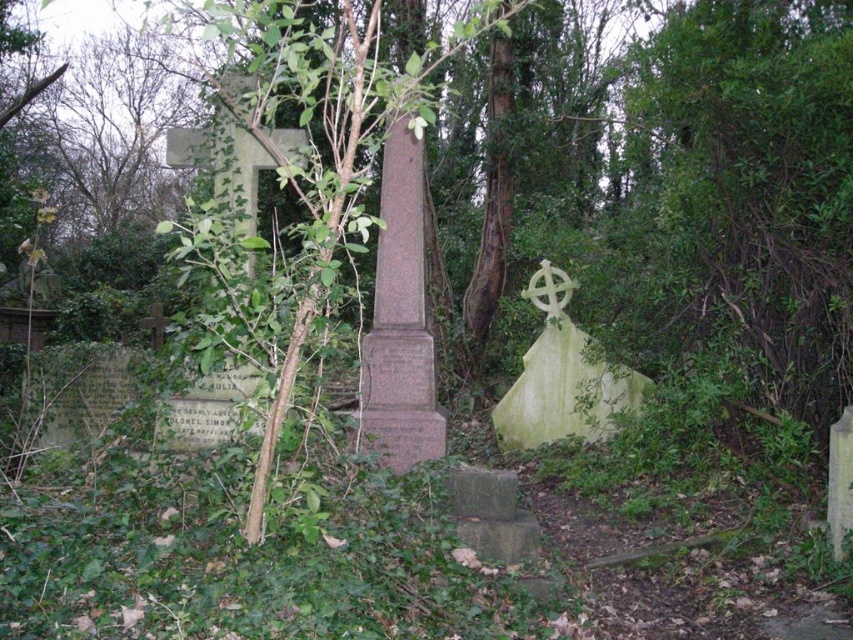
Question: Which of the following is the closest to the observer?

Choices:
 (A) (550, 276)
 (B) (366, 33)

Answer: (B)

Question: Can you confirm if green leafy tree at center is positioned to the left of white stone cross at center right?

Choices:
 (A) no
 (B) yes

Answer: (B)

Question: Among these objects, which one is farthest from the camera?

Choices:
 (A) green leafy tree at center
 (B) white stone cross at center right

Answer: (B)

Question: Does green leafy tree at center have a smaller size compared to white stone cross at center right?

Choices:
 (A) no
 (B) yes

Answer: (A)

Question: Is green leafy tree at center further to camera compared to white stone cross at center right?

Choices:
 (A) no
 (B) yes

Answer: (A)

Question: Among these objects, which one is nearest to the camera?

Choices:
 (A) white stone cross at center right
 (B) green leafy tree at center

Answer: (B)